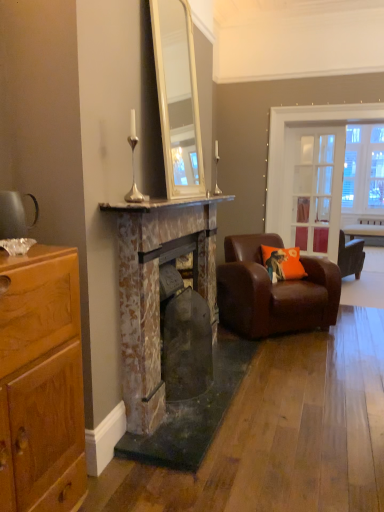
Question: Is marble mantel at center completely or partially outside of silver metallic candlestick at upper center, which is counted as the 2th table lamp, starting from the right?

Choices:
 (A) no
 (B) yes

Answer: (B)

Question: Is marble mantel at center smaller than silver metallic candlestick at upper center, the second table lamp when ordered from back to front?

Choices:
 (A) no
 (B) yes

Answer: (A)

Question: Is marble mantel at center not near silver metallic candlestick at upper center, positioned as the first table lamp in left-to-right order?

Choices:
 (A) no
 (B) yes

Answer: (A)

Question: Is marble mantel at center taller than silver metallic candlestick at upper center, positioned as the first table lamp in left-to-right order?

Choices:
 (A) yes
 (B) no

Answer: (B)

Question: Is marble mantel at center to the left of silver metallic candlestick at upper center, positioned as the first table lamp in left-to-right order, from the viewer's perspective?

Choices:
 (A) no
 (B) yes

Answer: (A)

Question: Considering their positions, is wooden table at right located in front of or behind silver metallic candlestick at upper center, positioned as the first table lamp in left-to-right order?

Choices:
 (A) front
 (B) behind

Answer: (B)

Question: From a real-world perspective, is wooden table at right above or below silver metallic candlestick at upper center, positioned as the first table lamp in left-to-right order?

Choices:
 (A) below
 (B) above

Answer: (A)

Question: Is wooden table at right situated inside silver metallic candlestick at upper center, arranged as the first table lamp when viewed from the front, or outside?

Choices:
 (A) inside
 (B) outside

Answer: (B)

Question: Is wooden table at right wider or thinner than silver metallic candlestick at upper center, which is counted as the 2th table lamp, starting from the right?

Choices:
 (A) wide
 (B) thin

Answer: (A)

Question: Is wooden table at right in front of or behind marble mantel at center in the image?

Choices:
 (A) behind
 (B) front

Answer: (A)

Question: Which is correct: wooden table at right is inside marble mantel at center, or outside of it?

Choices:
 (A) outside
 (B) inside

Answer: (A)

Question: Does point (360, 229) appear closer or farther from the camera than point (211, 196)?

Choices:
 (A) closer
 (B) farther

Answer: (B)

Question: Considering the positions of wooden table at right and marble mantel at center in the image, is wooden table at right wider or thinner than marble mantel at center?

Choices:
 (A) wide
 (B) thin

Answer: (A)

Question: Is silver metallic table lamp at upper center, which is the 1th table lamp from right to left, taller or shorter than rustic stone fireplace at center, placed as the 2th fireplace when sorted from back to front?

Choices:
 (A) tall
 (B) short

Answer: (B)

Question: Is silver metallic table lamp at upper center, which is the 1th table lamp from right to left, wider or thinner than rustic stone fireplace at center, placed as the 1th fireplace when sorted from front to back?

Choices:
 (A) wide
 (B) thin

Answer: (B)